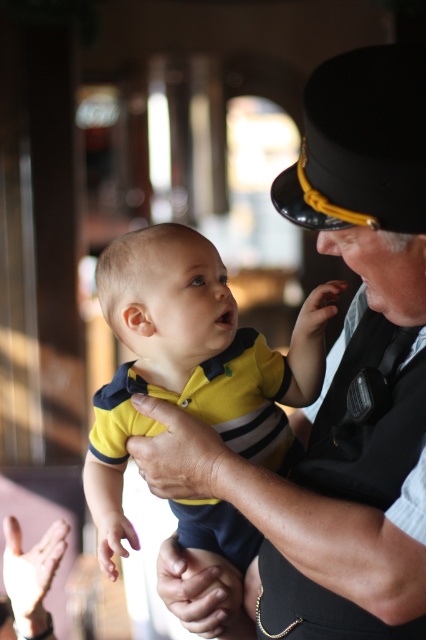
You are a photographer trying to capture a closeup of the baby in the image. The baby is wearing a yellow matte shirt at center and the man is wearing a black leather vest at center. Since the vest is blocking your view, which clothing item should you adjust to get a clear shot of the baby?

The black leather vest at center is behind the yellow matte shirt at center, so you should adjust the black leather vest at center to get a clear shot of the baby.